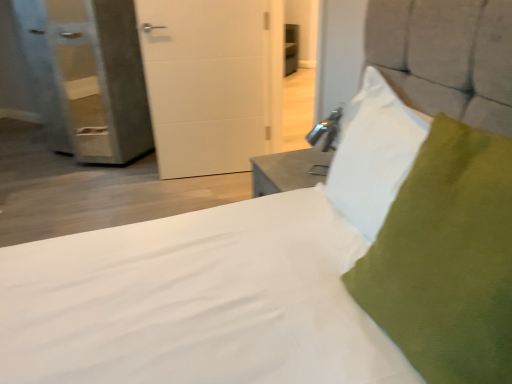
Question: Considering the relative sizes of green fabric pillow at upper right, acting as the first pillow starting from the front, and textured gray pillow at upper right, the 2th pillow when ordered from front to back, in the image provided, is green fabric pillow at upper right, acting as the first pillow starting from the front, smaller than textured gray pillow at upper right, the 2th pillow when ordered from front to back,?

Choices:
 (A) no
 (B) yes

Answer: (A)

Question: Is green fabric pillow at upper right, acting as the first pillow starting from the front, looking in the opposite direction of textured gray pillow at upper right, the 2th pillow when ordered from front to back?

Choices:
 (A) no
 (B) yes

Answer: (A)

Question: Would you say green fabric pillow at upper right, acting as the first pillow starting from the front, contains textured gray pillow at upper right, which ranks as the 1th pillow in back-to-front order?

Choices:
 (A) no
 (B) yes

Answer: (A)

Question: Is green fabric pillow at upper right, placed as the second pillow when sorted from back to front, closer to the viewer compared to textured gray pillow at upper right, the 2th pillow when ordered from front to back?

Choices:
 (A) no
 (B) yes

Answer: (B)

Question: Is green fabric pillow at upper right, placed as the second pillow when sorted from back to front, not close to textured gray pillow at upper right, the 2th pillow when ordered from front to back?

Choices:
 (A) no
 (B) yes

Answer: (A)

Question: Is green fabric pillow at upper right, placed as the second pillow when sorted from back to front, completely or partially outside of textured gray pillow at upper right, which ranks as the 1th pillow in back-to-front order?

Choices:
 (A) yes
 (B) no

Answer: (A)

Question: Is textured gray pillow at upper right, which ranks as the 1th pillow in back-to-front order, completely or partially outside of green fabric pillow at upper right, acting as the first pillow starting from the front?

Choices:
 (A) no
 (B) yes

Answer: (B)

Question: Is textured gray pillow at upper right, the 2th pillow when ordered from front to back, smaller than green fabric pillow at upper right, placed as the second pillow when sorted from back to front?

Choices:
 (A) no
 (B) yes

Answer: (B)

Question: Considering the relative positions of textured gray pillow at upper right, which ranks as the 1th pillow in back-to-front order, and green fabric pillow at upper right, acting as the first pillow starting from the front, in the image provided, is textured gray pillow at upper right, which ranks as the 1th pillow in back-to-front order, to the right of green fabric pillow at upper right, acting as the first pillow starting from the front, from the viewer's perspective?

Choices:
 (A) no
 (B) yes

Answer: (A)

Question: Is textured gray pillow at upper right, which ranks as the 1th pillow in back-to-front order, far from green fabric pillow at upper right, placed as the second pillow when sorted from back to front?

Choices:
 (A) no
 (B) yes

Answer: (A)

Question: From a real-world perspective, is textured gray pillow at upper right, the 2th pillow when ordered from front to back, on green fabric pillow at upper right, acting as the first pillow starting from the front?

Choices:
 (A) no
 (B) yes

Answer: (B)

Question: Is textured gray pillow at upper right, which ranks as the 1th pillow in back-to-front order, facing towards green fabric pillow at upper right, placed as the second pillow when sorted from back to front?

Choices:
 (A) no
 (B) yes

Answer: (A)

Question: Is white matte door at center behind textured gray pillow at upper right, the 2th pillow when ordered from front to back?

Choices:
 (A) yes
 (B) no

Answer: (A)